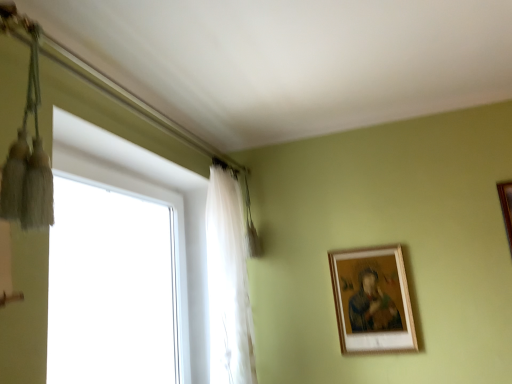
Question: Is translucent white curtain at upper left completely or partially inside brown wooden picture frame at upper right, the second picture frame when ordered from bottom to top?

Choices:
 (A) yes
 (B) no

Answer: (B)

Question: Considering the relative positions of brown wooden picture frame at upper right, which is the 1th picture frame from top to bottom, and translucent white curtain at upper left in the image provided, is brown wooden picture frame at upper right, which is the 1th picture frame from top to bottom, to the left of translucent white curtain at upper left from the viewer's perspective?

Choices:
 (A) yes
 (B) no

Answer: (B)

Question: Considering the relative sizes of brown wooden picture frame at upper right, the second picture frame positioned from the left, and translucent white curtain at upper left in the image provided, is brown wooden picture frame at upper right, the second picture frame positioned from the left, thinner than translucent white curtain at upper left?

Choices:
 (A) no
 (B) yes

Answer: (B)

Question: Is brown wooden picture frame at upper right, which is the 1th picture frame from top to bottom, wider than translucent white curtain at upper left?

Choices:
 (A) yes
 (B) no

Answer: (B)

Question: Is brown wooden picture frame at upper right, the second picture frame positioned from the left, not near translucent white curtain at upper left?

Choices:
 (A) yes
 (B) no

Answer: (A)

Question: From a real-world perspective, is brown wooden picture frame at upper right, the second picture frame when ordered from bottom to top, physically above translucent white curtain at upper left?

Choices:
 (A) yes
 (B) no

Answer: (A)

Question: Is white glass window at left shorter than translucent white curtain at upper left?

Choices:
 (A) yes
 (B) no

Answer: (A)

Question: Considering the relative sizes of white glass window at left and translucent white curtain at upper left in the image provided, is white glass window at left bigger than translucent white curtain at upper left?

Choices:
 (A) no
 (B) yes

Answer: (B)

Question: Considering the relative sizes of white glass window at left and translucent white curtain at upper left in the image provided, is white glass window at left thinner than translucent white curtain at upper left?

Choices:
 (A) no
 (B) yes

Answer: (B)

Question: Can you confirm if white glass window at left is taller than translucent white curtain at upper left?

Choices:
 (A) no
 (B) yes

Answer: (A)

Question: Considering the relative positions of white glass window at left and translucent white curtain at upper left in the image provided, is white glass window at left to the right of translucent white curtain at upper left from the viewer's perspective?

Choices:
 (A) yes
 (B) no

Answer: (B)

Question: Is white glass window at left completely or partially outside of translucent white curtain at upper left?

Choices:
 (A) no
 (B) yes

Answer: (B)

Question: Is translucent white curtain at upper left with white glass window at left?

Choices:
 (A) yes
 (B) no

Answer: (B)